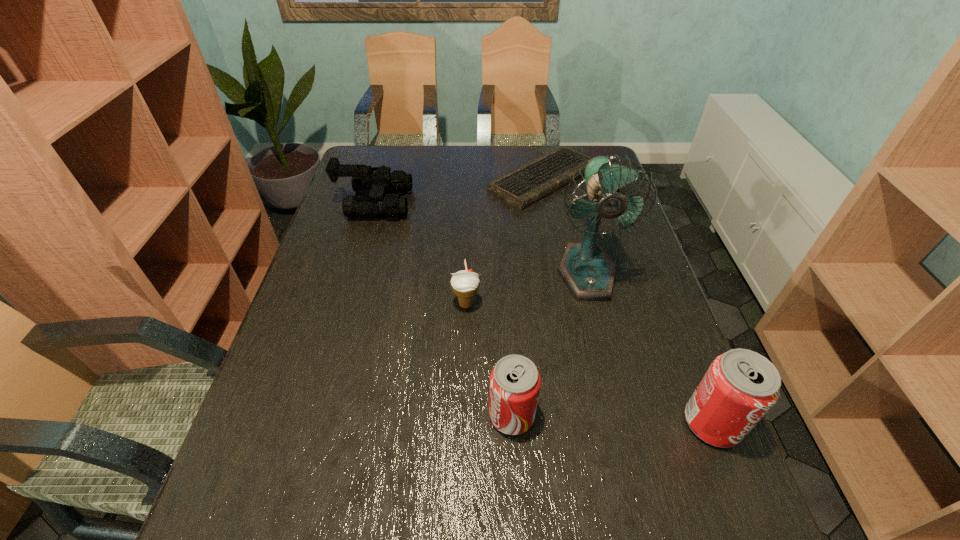
Find the location of `vacant space that satisfies the following two spatial constraints: 1. on the front lenses of the binoculars; 2. on the right side of the second object from left to right`. vacant space that satisfies the following two spatial constraints: 1. on the front lenses of the binoculars; 2. on the right side of the second object from left to right is located at coordinates (345, 304).

At what (x,y) coordinates should I click in order to perform the action: click on free spot that satisfies the following two spatial constraints: 1. in front of the taller soda can where the wind blows; 2. on the right side of the tallest object. Please return your answer as a coordinate pair (x, y). The width and height of the screenshot is (960, 540). Looking at the image, I should click on (624, 423).

The height and width of the screenshot is (540, 960). What are the coordinates of `free space that satisfies the following two spatial constraints: 1. on the back side of the computer keyboard; 2. on the right side of the second object from left to right` in the screenshot? It's located at (469, 179).

Image resolution: width=960 pixels, height=540 pixels. I want to click on free spot that satisfies the following two spatial constraints: 1. on the front lenses of the left soda can; 2. on the left side of the leftmost object, so click(313, 415).